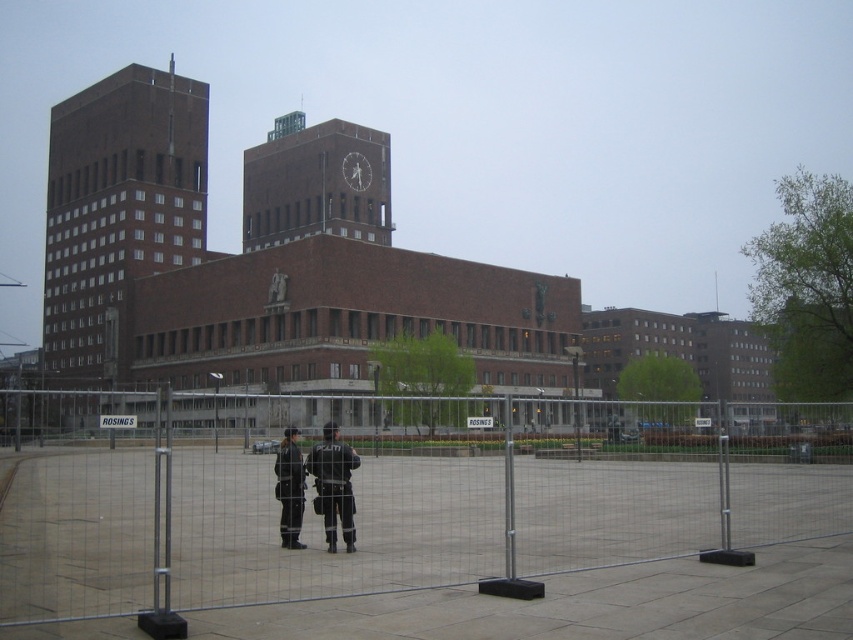
Can you confirm if silver wire mesh fence at center is wider than black leather jacket at center?

Yes.

Is point (753, 493) less distant than point (294, 512)?

No, (753, 493) is behind (294, 512).

Measure the distance between silver wire mesh fence at center and camera.

The distance of silver wire mesh fence at center from camera is 34.53 feet.

Where is `silver wire mesh fence at center`? This screenshot has height=640, width=853. silver wire mesh fence at center is located at coordinates (392, 492).

Is brown brick tower at left taller than black leather jacket at center?

Yes.

Who is taller, brown brick tower at left or black leather jacket at center?

Standing taller between the two is brown brick tower at left.

Identify the location of brown brick tower at left. (117, 212).

Consider the image. Does brick clock tower at center have a lesser height compared to reflective black uniforms at center?

Incorrect, brick clock tower at center's height does not fall short of reflective black uniforms at center's.

Consider the image. Can you confirm if brick clock tower at center is bigger than reflective black uniforms at center?

Yes, brick clock tower at center is bigger than reflective black uniforms at center.

The height and width of the screenshot is (640, 853). I want to click on brick clock tower at center, so click(x=316, y=182).